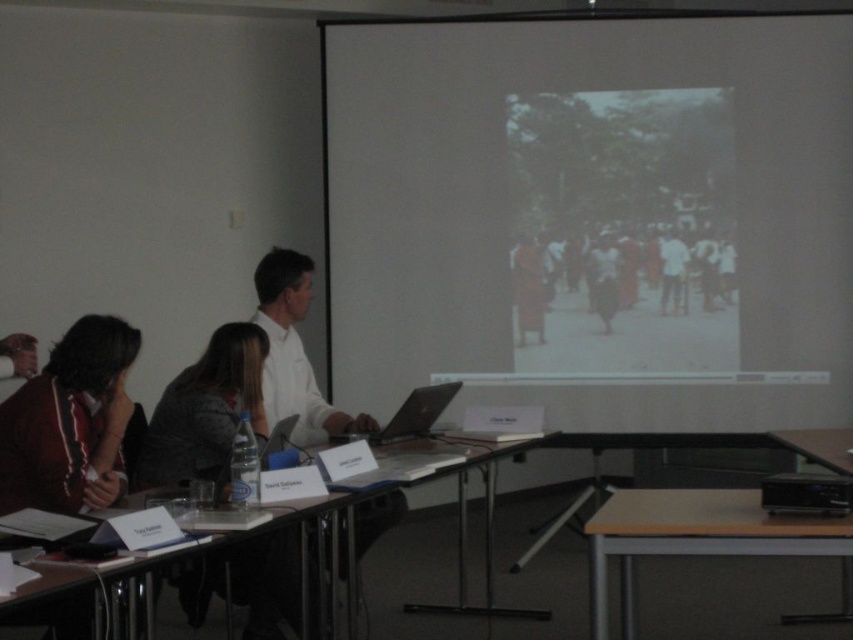
In the classroom scene, you see a patterned fabric jacket at lower left and a white matte shirt at center. Which clothing item is positioned more to the left?

The patterned fabric jacket at lower left is positioned more to the left than the white matte shirt at center.

You are a student in the classroom and need to quickly move from your desk to the projection screen to adjust it. Your desk is the wooden table at lower left. Can you reach the white matte projection screen at upper center in one swift motion without needing to stop?

The white matte projection screen at upper center and wooden table at lower left are 6.13 feet apart from each other. Since 6.13 feet is approximately 1.86 meters, which is a short distance, you can likely reach the screen in one swift motion without needing to stop.

In the classroom scene, there is a patterned fabric jacket at lower left and a wooden table at lower left. Which object is positioned more to the left side of the scene?

The patterned fabric jacket at lower left is positioned more to the left side of the scene than the wooden table at lower left.